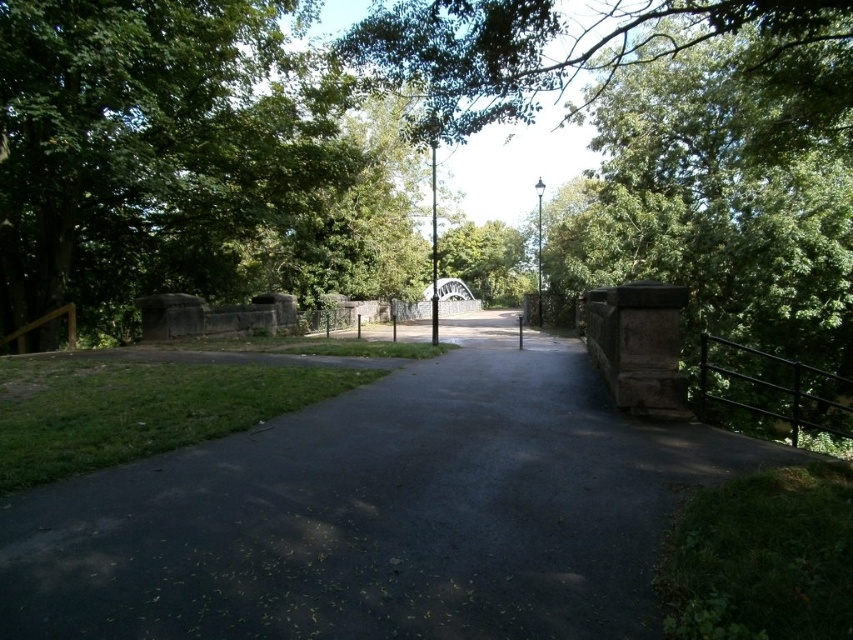
From the picture: You are standing at the point with coordinates point [380,513] in the scene. What object are you currently standing on?

The point [380,513] corresponds to the dark asphalt path at center, so you are standing on the dark asphalt path at center.

You are standing on the pathway and want to know which tree is taller between the green leafy tree at left and the green leafy tree at upper center. Which one is taller?

The green leafy tree at upper center is taller than the green leafy tree at left.